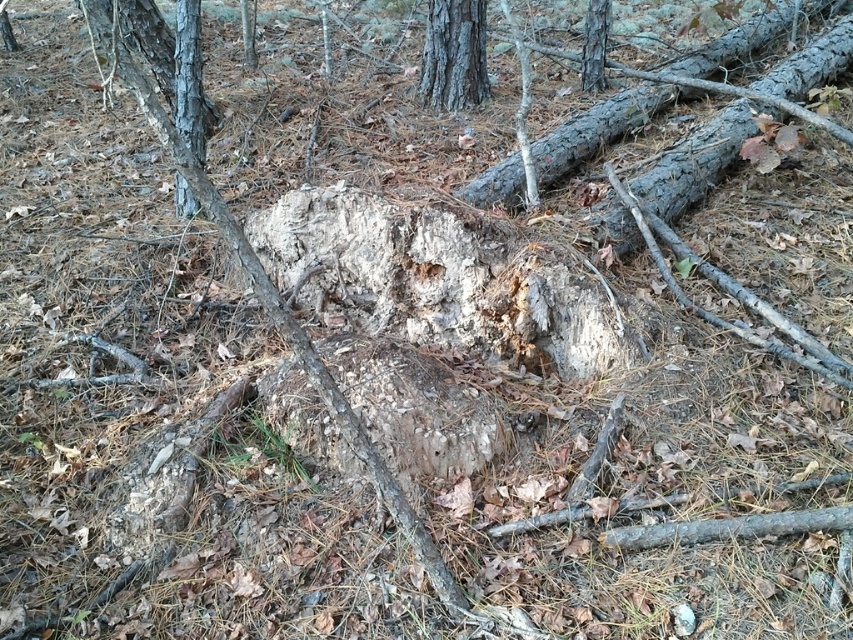
You are a hiker who wants to take a photo of the rough bark tree trunk at center and the smooth gray bark tree at upper center. Which one should you focus on first if you want to capture both in one shot?

You should focus on the rough bark tree trunk at center first because it is closer to you than the smooth gray bark tree at upper center, so focusing on the closer object will ensure both are in focus.

You are a hiker who wants to identify the tallest tree in this forest scene. Based on the image, which of the following is taller between the rough bark tree trunk at center and the smooth gray bark tree at upper center?

The rough bark tree trunk at center is taller than the smooth gray bark tree at upper center according to the description.

You are standing at the center of the forest floor scene. You notice a rough bark tree trunk at center. Where exactly is this tree trunk located in relation to the point marked at coordinates (271,301)?

The rough bark tree trunk at center is located exactly at the point marked at coordinates (271,301).